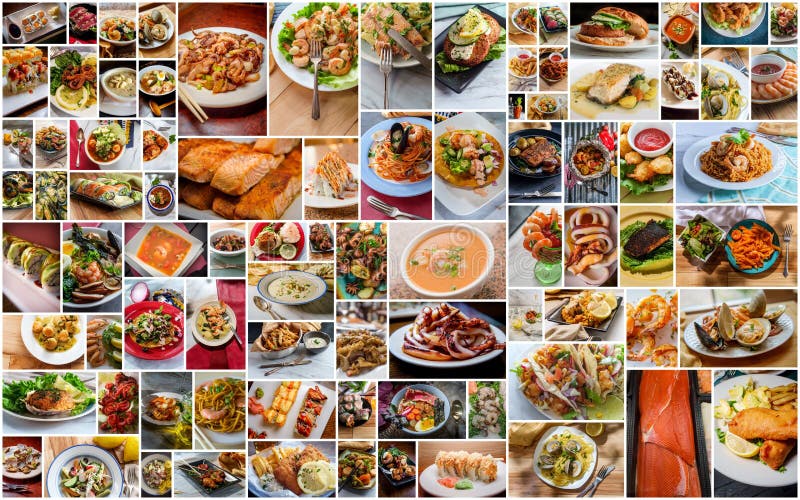
Identify the location of utensils. (316, 92), (384, 91), (201, 107), (382, 210), (598, 482), (128, 484).